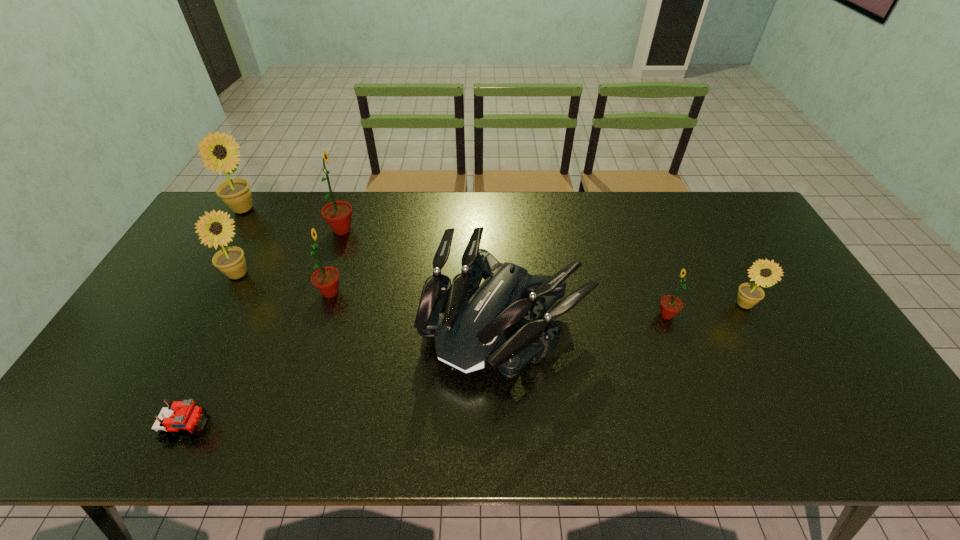
The width and height of the screenshot is (960, 540). I want to click on the leftmost sunflower, so click(235, 193).

Locate an element on the screen. the leftmost yellow sunflower is located at coordinates (235, 193).

This screenshot has width=960, height=540. Identify the location of the biggest green sunflower. (337, 214).

I want to click on the second smallest yellow sunflower, so click(x=230, y=260).

At what (x,y) coordinates should I click in order to perform the action: click on the second sunflower from left to right. Please return your answer as a coordinate pair (x, y). The width and height of the screenshot is (960, 540). Looking at the image, I should click on (230, 260).

You are a GUI agent. You are given a task and a screenshot of the screen. Output one action in this format:
    pyautogui.click(x=<x>, y=<y>)
    Task: Click on the second biggest green sunflower
    
    Given the screenshot: What is the action you would take?
    pyautogui.click(x=326, y=279)

Image resolution: width=960 pixels, height=540 pixels. I want to click on the smallest green sunflower, so click(x=670, y=305).

You are a GUI agent. You are given a task and a screenshot of the screen. Output one action in this format:
    pyautogui.click(x=<x>, y=<y>)
    Task: Click on the rightmost green sunflower
    The height and width of the screenshot is (540, 960).
    Given the screenshot: What is the action you would take?
    pyautogui.click(x=670, y=305)

You are a GUI agent. You are given a task and a screenshot of the screen. Output one action in this format:
    pyautogui.click(x=<x>, y=<y>)
    Task: Click on the rightmost yellow sunflower
    
    Given the screenshot: What is the action you would take?
    pyautogui.click(x=749, y=294)

Image resolution: width=960 pixels, height=540 pixels. I want to click on the nearest yellow sunflower, so click(749, 294).